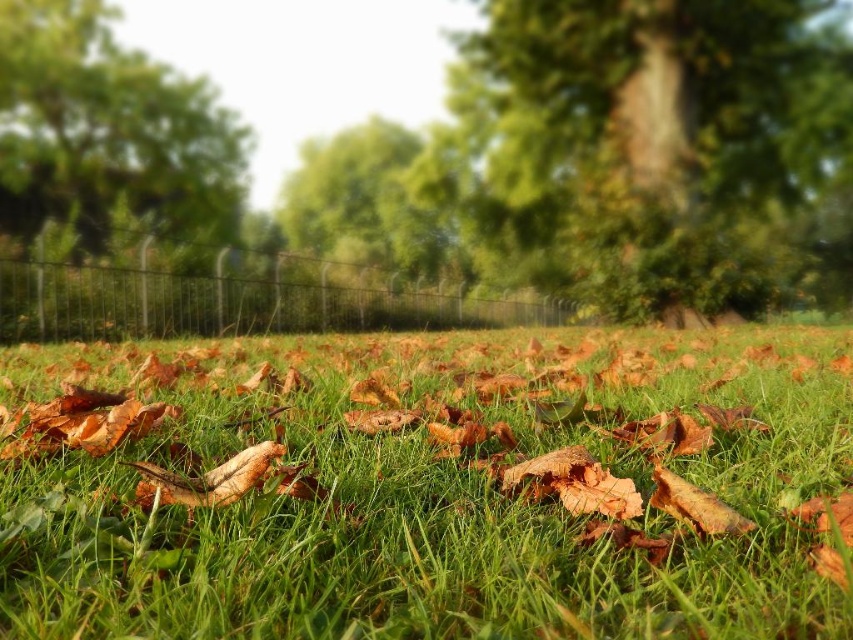
Question: Which of these objects is positioned closest to the green leafy tree at upper left?

Choices:
 (A) green grassy at center
 (B) black wire fence at center
 (C) green textured tree at upper center

Answer: (B)

Question: Is green grassy at center above green leafy tree at upper left?

Choices:
 (A) yes
 (B) no

Answer: (B)

Question: Does green grassy at center have a lesser width compared to green leafy tree at upper left?

Choices:
 (A) no
 (B) yes

Answer: (A)

Question: Which object is positioned closest to the black wire fence at center?

Choices:
 (A) green textured tree at upper center
 (B) green grassy at center
 (C) green leafy tree at upper left

Answer: (C)

Question: Which object is the closest to the green textured tree at upper center?

Choices:
 (A) black wire fence at center
 (B) green grassy at center

Answer: (A)

Question: Is green grassy at center further to camera compared to green textured tree at upper center?

Choices:
 (A) no
 (B) yes

Answer: (A)